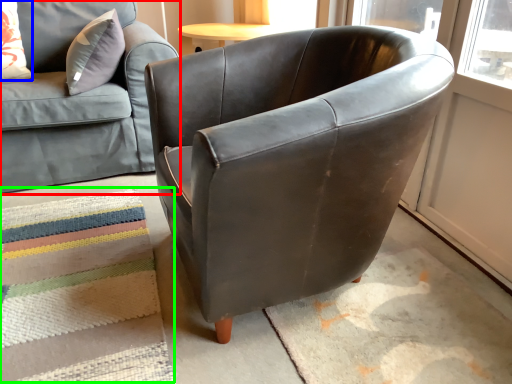
Question: Based on their relative distances, which object is farther from studio couch (highlighted by a red box)? Choose from pillow (highlighted by a blue box) and mat (highlighted by a green box).

Choices:
 (A) pillow
 (B) mat

Answer: (B)